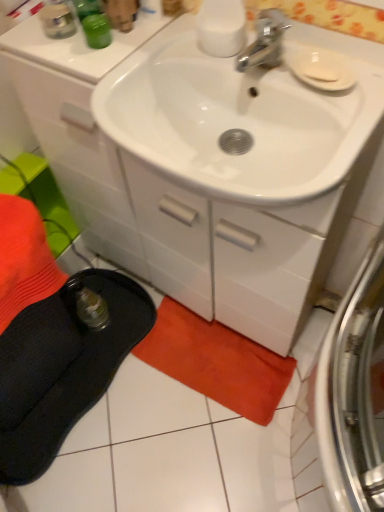
Measure the distance between black fabric slipper at lower left and camera.

The depth of black fabric slipper at lower left is 3.40 feet.

Identify the location of black fabric slipper at lower left. This screenshot has height=512, width=384. (62, 367).

Is white matte soap at upper right inside the boundaries of black fabric slipper at lower left, or outside?

white matte soap at upper right exists outside the volume of black fabric slipper at lower left.

From the image's perspective, is white matte soap at upper right above or below black fabric slipper at lower left?

From the image's perspective, white matte soap at upper right appears above black fabric slipper at lower left.

Is white matte soap at upper right beside black fabric slipper at lower left?

They are not placed beside each other.

Is white matte soap at upper right to the left of black fabric slipper at lower left from the viewer's perspective?

No.

From a real-world perspective, who is located lower, white glossy cabinet at center or white matte soap at upper right?

white glossy cabinet at center is physically lower.

Does point (377, 79) lie in front of point (305, 75)?

Yes, it is in front of point (305, 75).

Which of these two, white glossy cabinet at center or white matte soap at upper right, is smaller?

white matte soap at upper right is smaller.

Would you consider white glossy cabinet at center to be distant from white matte soap at upper right?

white glossy cabinet at center is actually quite close to white matte soap at upper right.

Is white glossy cabinet at center a part of black fabric slipper at lower left?

No.

Would you say black fabric slipper at lower left is a long distance from white glossy cabinet at center?

They are positioned close to each other.

Is black fabric slipper at lower left in front of or behind white glossy cabinet at center in the image?

black fabric slipper at lower left is positioned farther from the viewer than white glossy cabinet at center.

From a real-world perspective, between black fabric slipper at lower left and white glossy cabinet at center, who is vertically lower?

black fabric slipper at lower left is physically lower.

Does point (305, 130) lie in front of point (22, 312)?

Yes, it is in front of point (22, 312).

Considering the sizes of objects white glossy cabinet at center and black fabric slipper at lower left in the image provided, who is taller, white glossy cabinet at center or black fabric slipper at lower left?

With more height is white glossy cabinet at center.

What's the angular difference between white glossy cabinet at center and black fabric slipper at lower left's facing directions?

They differ by 92.6 degrees in their facing directions.

Can you confirm if white glossy cabinet at center is smaller than black fabric slipper at lower left?

No, white glossy cabinet at center is not smaller than black fabric slipper at lower left.

From a real-world perspective, is black fabric slipper at lower left over orange cotton beach towel at lower center?

Yes.

Can you confirm if black fabric slipper at lower left is thinner than orange cotton beach towel at lower center?

No.

Which is farther, (x=85, y=349) or (x=278, y=394)?

Point (x=85, y=349)

Considering the sizes of black fabric slipper at lower left and orange cotton beach towel at lower center in the image, is black fabric slipper at lower left taller or shorter than orange cotton beach towel at lower center?

Considering their sizes, black fabric slipper at lower left has less height than orange cotton beach towel at lower center.

Is white matte soap at upper right next to orange cotton beach towel at lower center and touching it?

No, white matte soap at upper right is not making contact with orange cotton beach towel at lower center.

Considering the sizes of objects white matte soap at upper right and orange cotton beach towel at lower center in the image provided, who is shorter, white matte soap at upper right or orange cotton beach towel at lower center?

white matte soap at upper right.

From the image's perspective, is white matte soap at upper right above orange cotton beach towel at lower center?

Correct, white matte soap at upper right appears higher than orange cotton beach towel at lower center in the image.

In the image, is white matte soap at upper right positioned in front of or behind orange cotton beach towel at lower center?

Visually, white matte soap at upper right is located in front of orange cotton beach towel at lower center.

From a real-world perspective, is white matte soap at upper right positioned under white glossy cabinet at center based on gravity?

No, from a real-world perspective, white matte soap at upper right is not beneath white glossy cabinet at center.

Is white matte soap at upper right placed right next to white glossy cabinet at center?

white matte soap at upper right is not next to white glossy cabinet at center, and they're not touching.

Where is `soap above the white glossy cabinet at center (from the image's perspective)`? This screenshot has width=384, height=512. soap above the white glossy cabinet at center (from the image's perspective) is located at coordinates (321, 72).

Which object is thinner, white matte soap at upper right or white glossy cabinet at center?

With smaller width is white matte soap at upper right.

The height and width of the screenshot is (512, 384). I want to click on slipper behind the white matte soap at upper right, so click(62, 367).

Locate an element on the screen. bathroom cabinet that appears below the white matte soap at upper right (from the image's perspective) is located at coordinates (208, 168).

Based on their spatial positions, is white glossy cabinet at center or orange cotton beach towel at lower center further from white matte soap at upper right?

The object further to white matte soap at upper right is orange cotton beach towel at lower center.

Considering their positions, is white matte soap at upper right positioned closer to white glossy cabinet at center than orange cotton beach towel at lower center?

white matte soap at upper right is closer to white glossy cabinet at center.

Looking at the image, which one is located further to black fabric slipper at lower left, orange cotton beach towel at lower center or white matte soap at upper right?

Among the two, white matte soap at upper right is located further to black fabric slipper at lower left.

Which object lies nearer to the anchor point white matte soap at upper right, orange cotton beach towel at lower center or black fabric slipper at lower left?

orange cotton beach towel at lower center is positioned closer to the anchor white matte soap at upper right.

When comparing their distances from white glossy cabinet at center, does orange cotton beach towel at lower center or black fabric slipper at lower left seem further?

black fabric slipper at lower left is positioned further to the anchor white glossy cabinet at center.

Estimate the real-world distances between objects in this image. Which object is further from white matte soap at upper right, black fabric slipper at lower left or orange cotton beach towel at lower center?

black fabric slipper at lower left lies further to white matte soap at upper right than the other object.

Which object lies nearer to the anchor point black fabric slipper at lower left, orange cotton beach towel at lower center or white glossy cabinet at center?

Based on the image, orange cotton beach towel at lower center appears to be nearer to black fabric slipper at lower left.

Which object lies nearer to the anchor point white matte soap at upper right, black fabric slipper at lower left or white glossy cabinet at center?

The object closer to white matte soap at upper right is white glossy cabinet at center.

Image resolution: width=384 pixels, height=512 pixels. I want to click on slipper positioned between white glossy cabinet at center and orange cotton beach towel at lower center from near to far, so click(x=62, y=367).

Image resolution: width=384 pixels, height=512 pixels. I want to click on slipper between white matte soap at upper right and orange cotton beach towel at lower center vertically, so click(62, 367).

Where is `bathroom cabinet between white matte soap at upper right and orange cotton beach towel at lower center vertically`? Image resolution: width=384 pixels, height=512 pixels. bathroom cabinet between white matte soap at upper right and orange cotton beach towel at lower center vertically is located at coordinates (208, 168).

This screenshot has height=512, width=384. In order to click on bathroom cabinet that lies between white matte soap at upper right and black fabric slipper at lower left from top to bottom in this screenshot , I will do `click(208, 168)`.